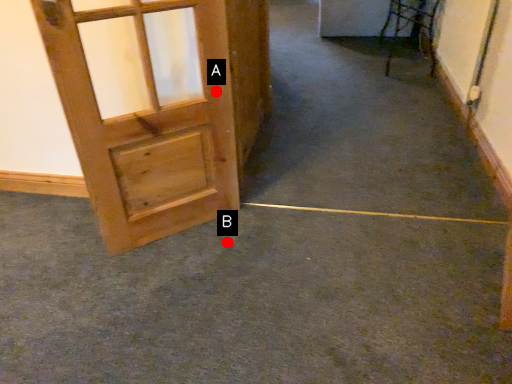
Question: Two points are circled on the image, labeled by A and B beside each circle. Which point is further to the camera?

Choices:
 (A) A is further
 (B) B is further

Answer: (B)